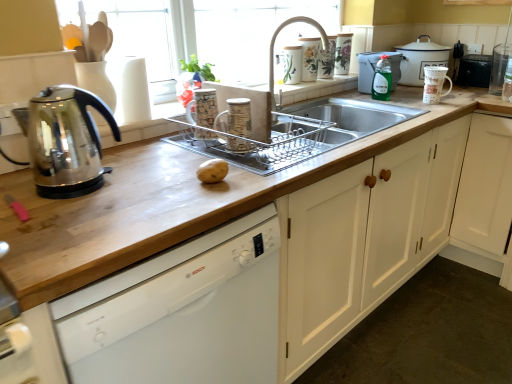
Locate an element on the screen. free area in between transparent glass kettle at left, the first kitchen appliance in the left-to-right sequence, and brown matte potato at center is located at coordinates (150, 178).